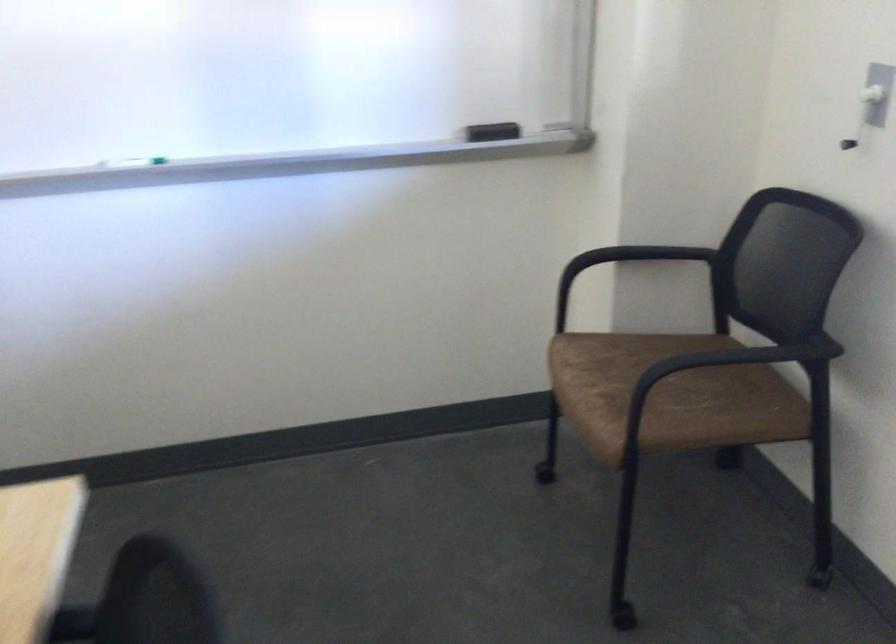
At what (x,y) coordinates should I click in order to perform the action: click on white light switch. Please return your answer as a coordinate pair (x, y). Looking at the image, I should click on (872, 93).